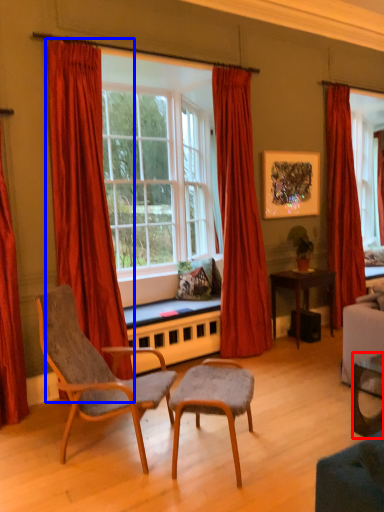
Question: Which object is closer to the camera taking this photo, desk (highlighted by a red box) or curtain (highlighted by a blue box)?

Choices:
 (A) desk
 (B) curtain

Answer: (A)